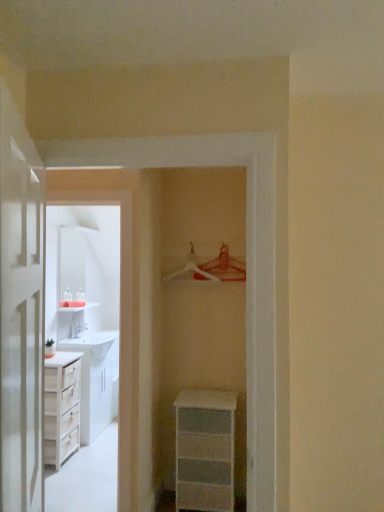
Question: Could you tell me if white wood cabinet at left is facing white glossy door at left?

Choices:
 (A) yes
 (B) no

Answer: (B)

Question: From a real-world perspective, does white wood cabinet at left stand above white glossy door at left?

Choices:
 (A) yes
 (B) no

Answer: (B)

Question: Is white wood cabinet at left in contact with white glossy door at left?

Choices:
 (A) yes
 (B) no

Answer: (B)

Question: Considering the relative sizes of white wood cabinet at left and white glossy door at left in the image provided, is white wood cabinet at left smaller than white glossy door at left?

Choices:
 (A) yes
 (B) no

Answer: (A)

Question: Is the depth of white wood cabinet at left greater than that of white glossy door at left?

Choices:
 (A) yes
 (B) no

Answer: (A)

Question: Is metallic silver hanger at upper center, the 1th hanger positioned from the right, to the left or to the right of white glossy door at left in the image?

Choices:
 (A) left
 (B) right

Answer: (B)

Question: In the image, is metallic silver hanger at upper center, the 1th hanger positioned from the right, positioned in front of or behind white glossy door at left?

Choices:
 (A) behind
 (B) front

Answer: (A)

Question: Considering the positions of metallic silver hanger at upper center, the 1th hanger positioned from the right, and white glossy door at left in the image, is metallic silver hanger at upper center, the 1th hanger positioned from the right, taller or shorter than white glossy door at left?

Choices:
 (A) tall
 (B) short

Answer: (B)

Question: From a real-world perspective, is metallic silver hanger at upper center, the second hanger from the left, above or below white glossy door at left?

Choices:
 (A) below
 (B) above

Answer: (B)

Question: From the image's perspective, relative to white plastic hanger at center, arranged as the second hanger when viewed from the right, is white glossy door at left above or below?

Choices:
 (A) below
 (B) above

Answer: (A)

Question: Is white glossy door at left to the left or to the right of white plastic hanger at center, arranged as the second hanger when viewed from the right, in the image?

Choices:
 (A) left
 (B) right

Answer: (A)

Question: Is white glossy door at left inside or outside of white plastic hanger at center, acting as the 1th hanger starting from the left?

Choices:
 (A) outside
 (B) inside

Answer: (A)

Question: In terms of width, does white glossy door at left look wider or thinner when compared to white plastic hanger at center, acting as the 1th hanger starting from the left?

Choices:
 (A) wide
 (B) thin

Answer: (A)

Question: Relative to white wood cabinet at left, is metallic silver hanger at upper center, the second hanger from the left, in front or behind?

Choices:
 (A) front
 (B) behind

Answer: (B)

Question: Considering the positions of point (216, 266) and point (120, 503), is point (216, 266) closer or farther from the camera than point (120, 503)?

Choices:
 (A) farther
 (B) closer

Answer: (A)